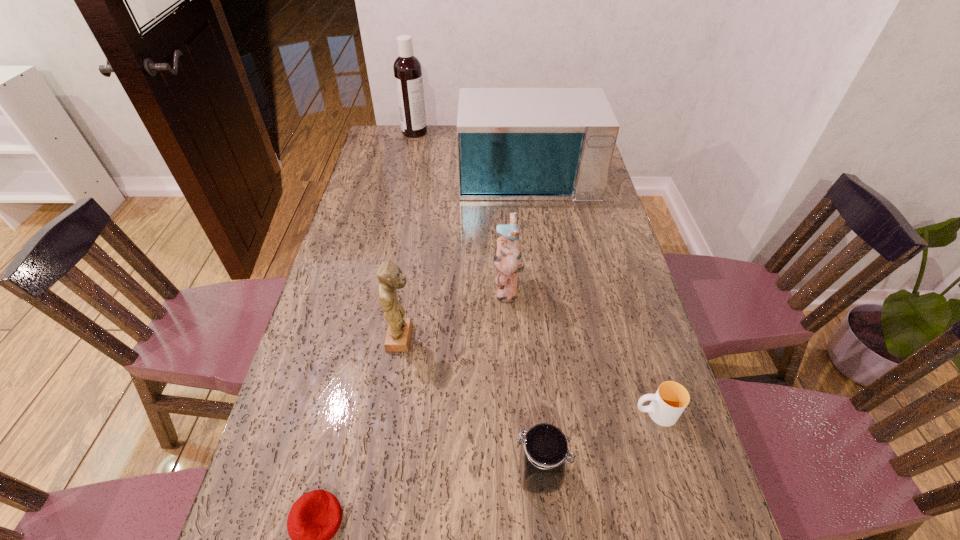
Choose which object is the nearest neighbor to the beanbag. Please provide its 2D coordinates. Your answer should be formatted as a tuple, i.e. [(x, y)], where the tuple contains the x and y coordinates of a point satisfying the conditions above.

[(543, 450)]

Locate an element on the screen. The height and width of the screenshot is (540, 960). vacant region that satisfies the following two spatial constraints: 1. on the front-facing side of the second farthest object; 2. on the front-facing side of the nearer figurine is located at coordinates (549, 338).

This screenshot has height=540, width=960. Find the location of `vacant position in the image that satisfies the following two spatial constraints: 1. with the handle on the side of the fifth farthest object; 2. on the label side of the tallest object`. vacant position in the image that satisfies the following two spatial constraints: 1. with the handle on the side of the fifth farthest object; 2. on the label side of the tallest object is located at coordinates (572, 132).

Locate an element on the screen. vacant space that satisfies the following two spatial constraints: 1. with the handle on the side of the cup; 2. on the front-facing side of the left figurine is located at coordinates (633, 338).

You are a GUI agent. You are given a task and a screenshot of the screen. Output one action in this format:
    pyautogui.click(x=<x>, y=<y>)
    Task: Click on the vacant space that satisfies the following two spatial constraints: 1. with the handle on the side of the cup; 2. on the front-facing side of the right figurine
    This screenshot has height=540, width=960.
    Given the screenshot: What is the action you would take?
    pyautogui.click(x=618, y=287)